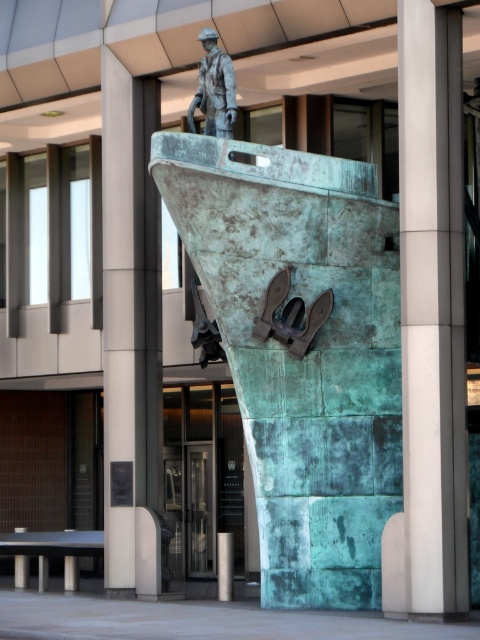
Question: Estimate the real-world distances between objects in this image. Which object is closer to the green patina stone at upper center?

Choices:
 (A) bronze statue at upper center
 (B) smooth gray concrete pillar at center

Answer: (B)

Question: Based on their relative distances, which object is nearer to the green patina stone at upper center?

Choices:
 (A) bronze statue at upper center
 (B) smooth gray concrete pillar at center

Answer: (B)

Question: Can you confirm if smooth gray concrete pillar at center is wider than bronze statue at upper center?

Choices:
 (A) no
 (B) yes

Answer: (A)

Question: Can you confirm if green patina stone at upper center is positioned to the left of bronze statue at upper center?

Choices:
 (A) yes
 (B) no

Answer: (A)

Question: Which point is closer to the camera?

Choices:
 (A) (403, 336)
 (B) (153, 332)
 (C) (220, 113)

Answer: (A)

Question: Is the position of green patina stone at upper center less distant than that of bronze statue at upper center?

Choices:
 (A) no
 (B) yes

Answer: (A)